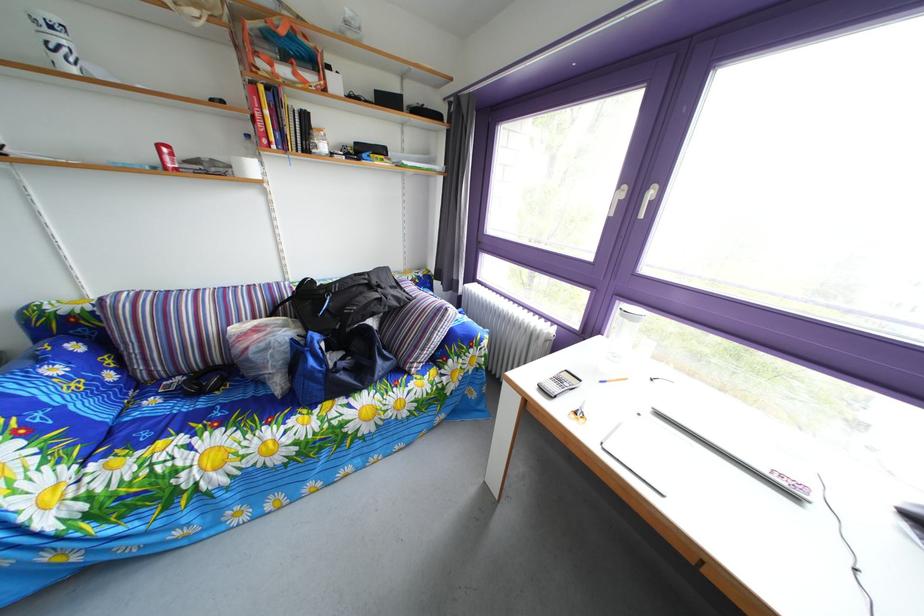
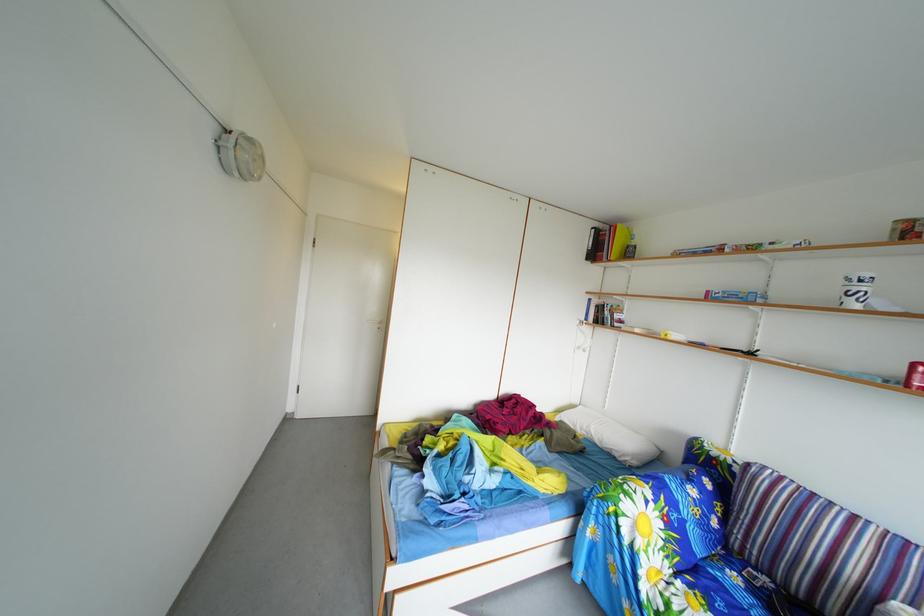
Question: The images are taken continuously from a first-person perspective. In which direction is your viewpoint rotating?

Choices:
 (A) Left
 (B) Right
 (C) Up
 (D) Down

Answer: (A)